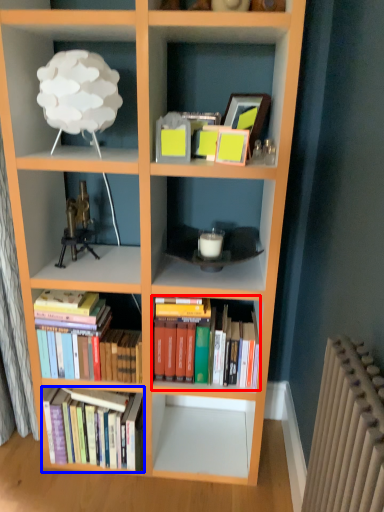
Question: Which of the following is the farthest to the observer, book (highlighted by a red box) or book (highlighted by a blue box)?

Choices:
 (A) book
 (B) book

Answer: (B)